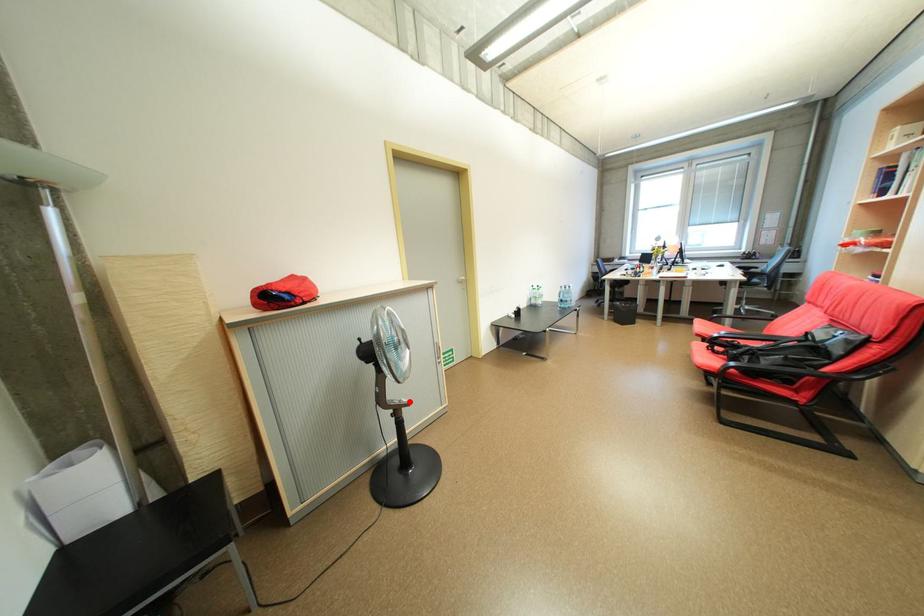
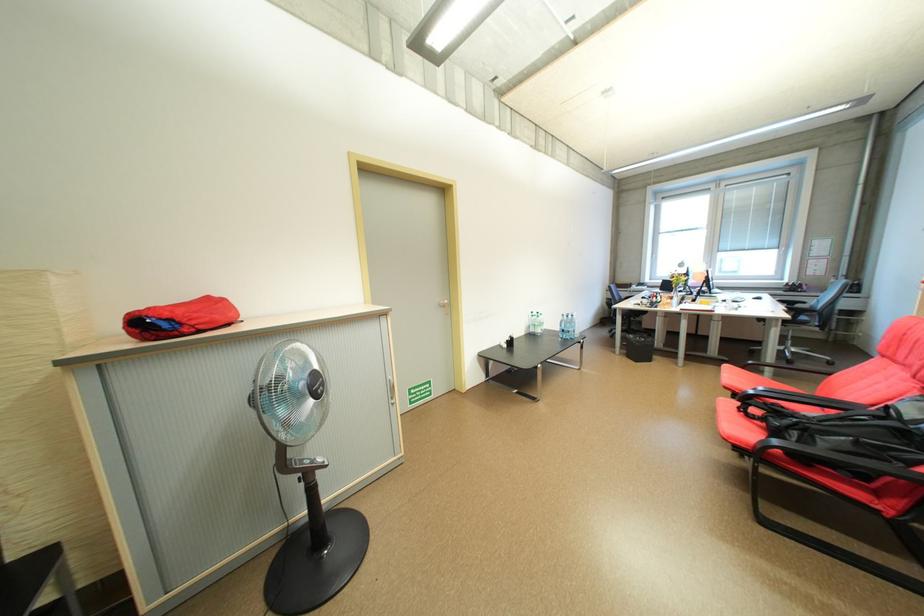
Where in the second image is the point corresponding to the highlighted location from the first image?

(322, 462)